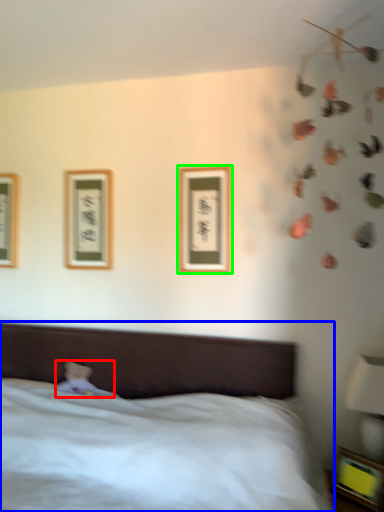
Question: Estimate the real-world distances between objects in this image. Which object is closer to toy (highlighted by a red box), bed (highlighted by a blue box) or picture frame (highlighted by a green box)?

Choices:
 (A) bed
 (B) picture frame

Answer: (A)